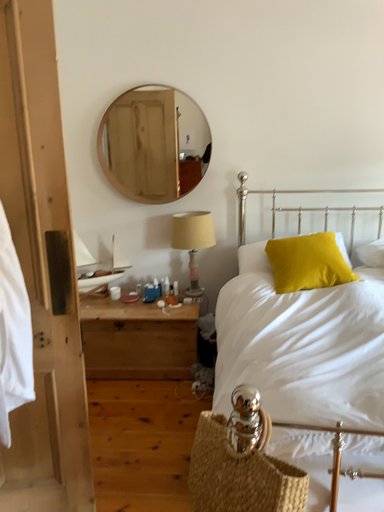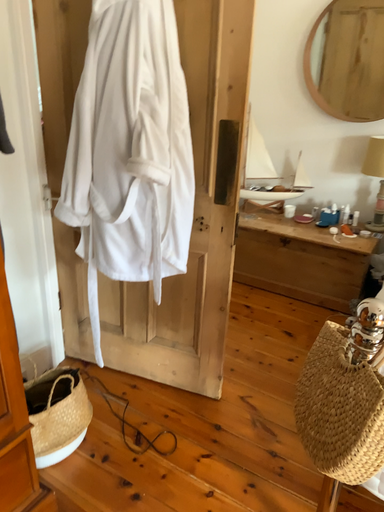
Question: How did the camera likely rotate when shooting the video?

Choices:
 (A) rotated right
 (B) rotated left

Answer: (B)